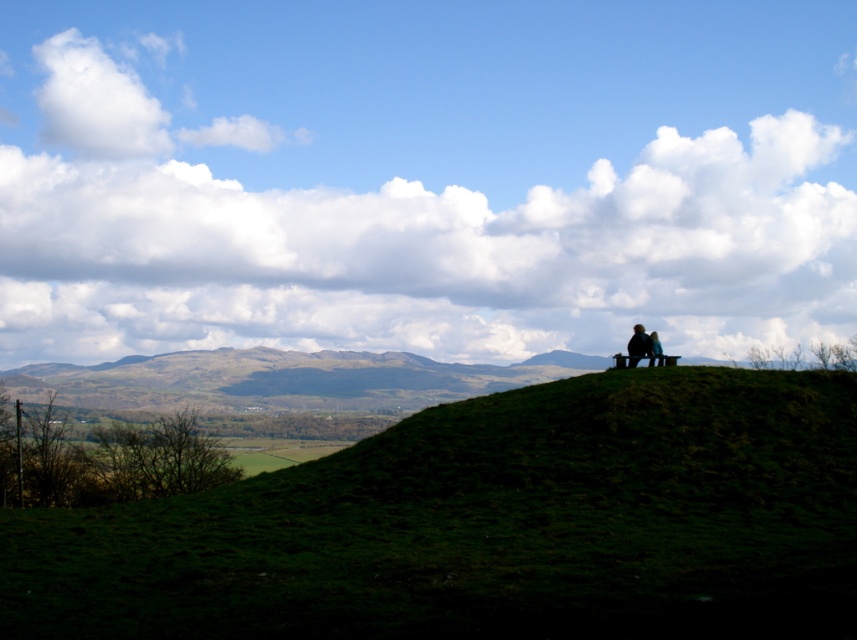
Between point (514, 618) and point (639, 356), which one is positioned behind?

The point (639, 356) is behind.

Is green grassy hillside at upper center closer to camera compared to silhouette wooden bench at upper right?

Yes.

Does point (168, 534) lie behind point (639, 355)?

That is False.

This screenshot has width=857, height=640. I want to click on green grassy hillside at upper center, so click(490, 525).